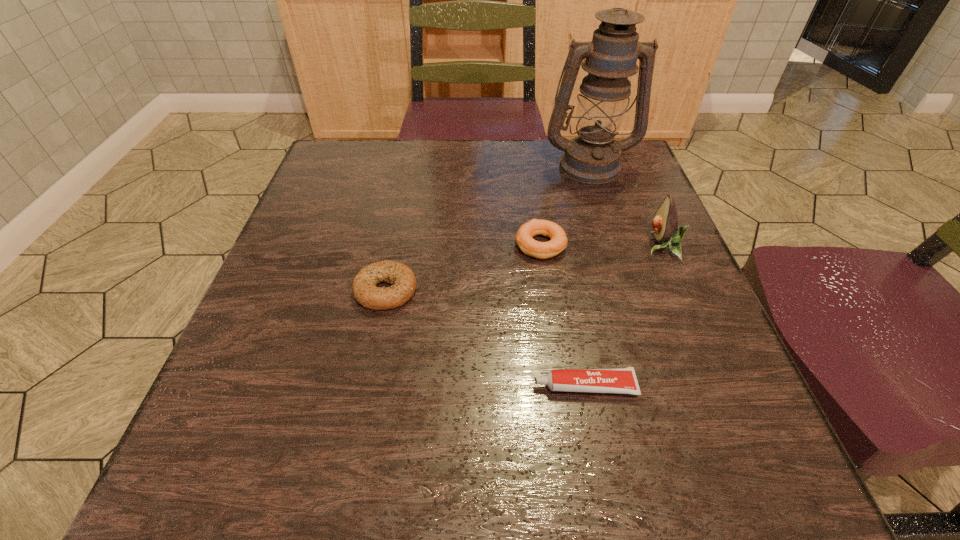
At what (x,y) coordinates should I click in order to perform the action: click on vacant space that satisfies the following two spatial constraints: 1. on the back side of the fourth farthest object; 2. on the left side of the farthest object. Please return your answer as a coordinate pair (x, y). The image size is (960, 540). Looking at the image, I should click on 411,165.

I want to click on vacant area that satisfies the following two spatial constraints: 1. on the back side of the tallest object; 2. on the right side of the nearer bagel, so click(x=411, y=165).